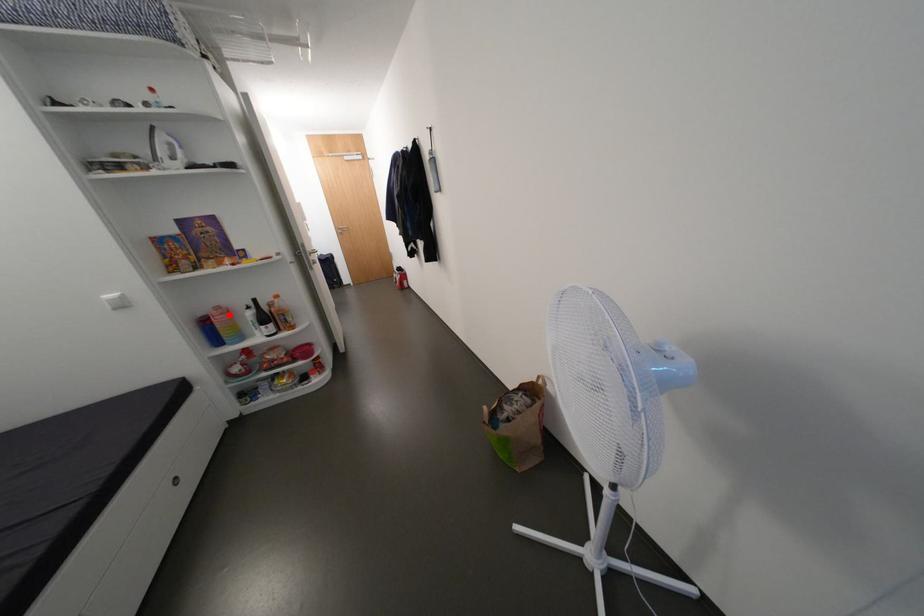
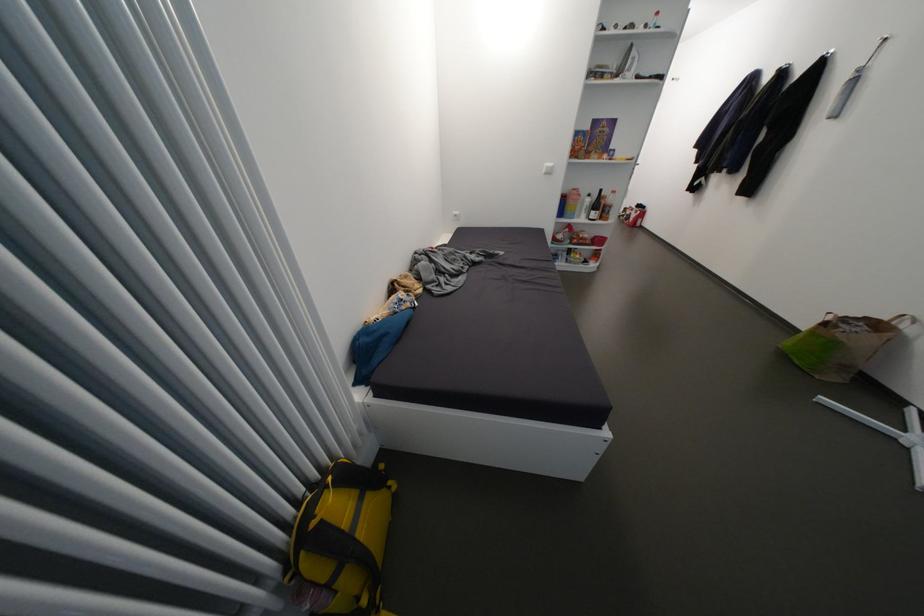
Find the pixel in the second image that matches the highlighted location in the first image.

(585, 196)